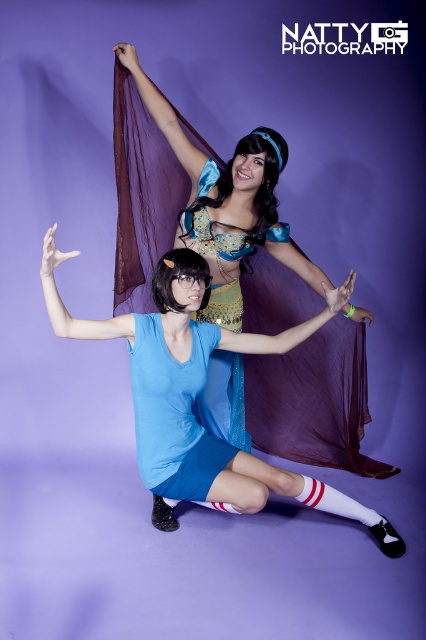
You are a photographer setting up for a photoshoot. You need to ensure that both the blue satin dress at center and the matte blue wig at center are visible in the final shot. Based on their positions, which object is closer to the camera?

The blue satin dress at center is closer to the camera because the matte blue wig at center is positioned behind it.

You are a photographer adjusting the focus of your camera. You need to focus on the two points in the image labeled as point (206, 232) and point (114, 336). Which point should you focus on first to ensure both are in sharp focus?

You should focus on point (206, 232) first because it is closer to the viewer than point (114, 336). By focusing on the closer point, the depth of field will naturally include the farther point in sharp focus.

From the picture: You are organizing a fashion show and need to decide which dress to display first. The blue satin dress at center and the matte blue dress at center are both contenders. Based on their widths, which dress should be placed in the narrower runway section that can only accommodate a dress up to the width of the narrower dress?

The blue satin dress at center should be placed in the narrower runway section since its width is less than the matte blue dress at center.